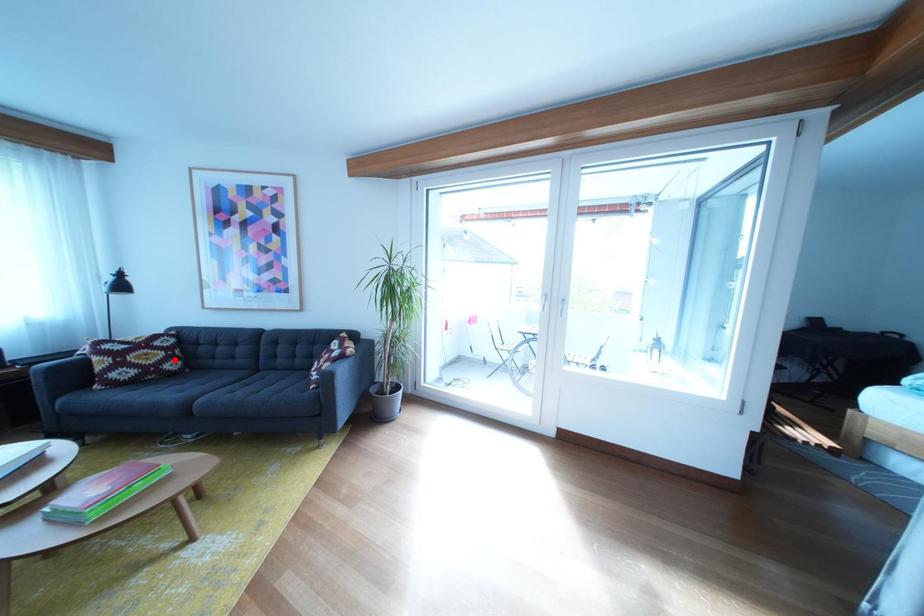
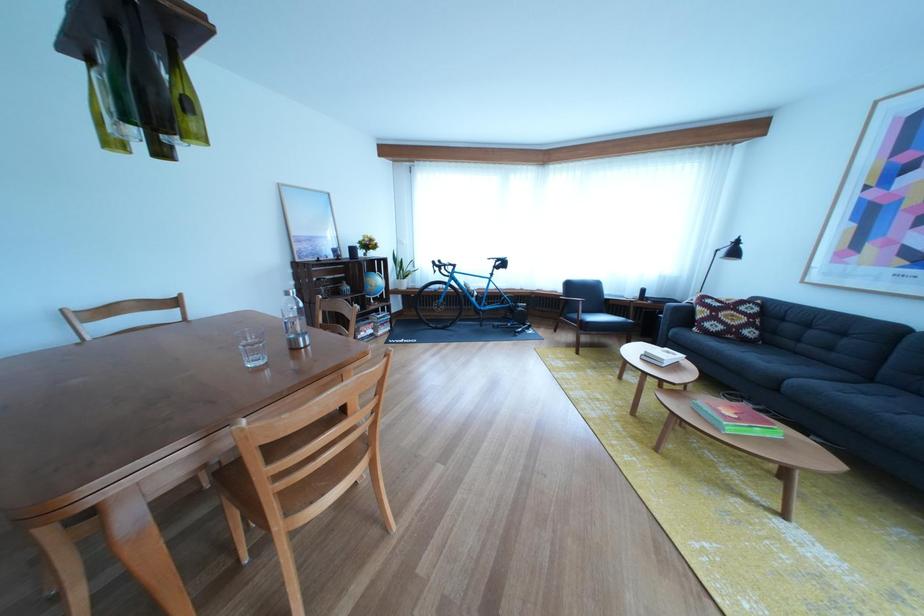
The point at the highlighted location is marked in the first image. Where is the corresponding point in the second image?

(757, 325)